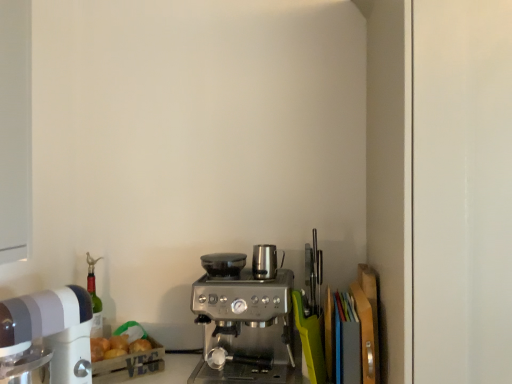
Question: Does satin silver espresso machine at center, acting as the 1th appliance starting from the left, have a smaller size compared to satin silver kettle at center, arranged as the 2th appliance when viewed from the left?

Choices:
 (A) yes
 (B) no

Answer: (A)

Question: Does satin silver espresso machine at center, acting as the 1th appliance starting from the left, have a lesser height compared to satin silver kettle at center, the 1th appliance in the right-to-left sequence?

Choices:
 (A) no
 (B) yes

Answer: (B)

Question: Is satin silver espresso machine at center, the 2th appliance positioned from the right, to the right of satin silver kettle at center, the 1th appliance in the right-to-left sequence, from the viewer's perspective?

Choices:
 (A) no
 (B) yes

Answer: (A)

Question: From the image's perspective, does satin silver espresso machine at center, acting as the 1th appliance starting from the left, appear lower than satin silver kettle at center, the 1th appliance in the right-to-left sequence?

Choices:
 (A) yes
 (B) no

Answer: (A)

Question: From a real-world perspective, does satin silver espresso machine at center, the 2th appliance positioned from the right, stand above satin silver kettle at center, the 1th appliance in the right-to-left sequence?

Choices:
 (A) yes
 (B) no

Answer: (B)

Question: Considering the positions of white plastic mixer at left and satin silver espresso machine at center, the 2th appliance positioned from the right, in the image, is white plastic mixer at left wider or thinner than satin silver espresso machine at center, the 2th appliance positioned from the right,?

Choices:
 (A) wide
 (B) thin

Answer: (A)

Question: Is white plastic mixer at left inside or outside of satin silver espresso machine at center, acting as the 1th appliance starting from the left?

Choices:
 (A) outside
 (B) inside

Answer: (A)

Question: In terms of size, does white plastic mixer at left appear bigger or smaller than satin silver espresso machine at center, the 2th appliance positioned from the right?

Choices:
 (A) small
 (B) big

Answer: (B)

Question: In terms of height, does white plastic mixer at left look taller or shorter compared to satin silver espresso machine at center, acting as the 1th appliance starting from the left?

Choices:
 (A) tall
 (B) short

Answer: (A)

Question: From a real-world perspective, relative to satin silver kettle at center, arranged as the 2th appliance when viewed from the left, is satin silver coffee maker at center vertically above or below?

Choices:
 (A) below
 (B) above

Answer: (A)

Question: Is satin silver coffee maker at center wider or thinner than satin silver kettle at center, the 1th appliance in the right-to-left sequence?

Choices:
 (A) wide
 (B) thin

Answer: (A)

Question: From the image's perspective, is satin silver coffee maker at center positioned above or below satin silver kettle at center, arranged as the 2th appliance when viewed from the left?

Choices:
 (A) below
 (B) above

Answer: (A)

Question: Considering the relative positions of satin silver coffee maker at center and satin silver kettle at center, the 1th appliance in the right-to-left sequence, in the image provided, is satin silver coffee maker at center to the left or to the right of satin silver kettle at center, the 1th appliance in the right-to-left sequence,?

Choices:
 (A) left
 (B) right

Answer: (A)

Question: Is satin silver kettle at center, the 1th appliance in the right-to-left sequence, in front of or behind satin silver coffee maker at center in the image?

Choices:
 (A) behind
 (B) front

Answer: (A)

Question: From a real-world perspective, is satin silver kettle at center, the 1th appliance in the right-to-left sequence, above or below satin silver coffee maker at center?

Choices:
 (A) below
 (B) above

Answer: (B)